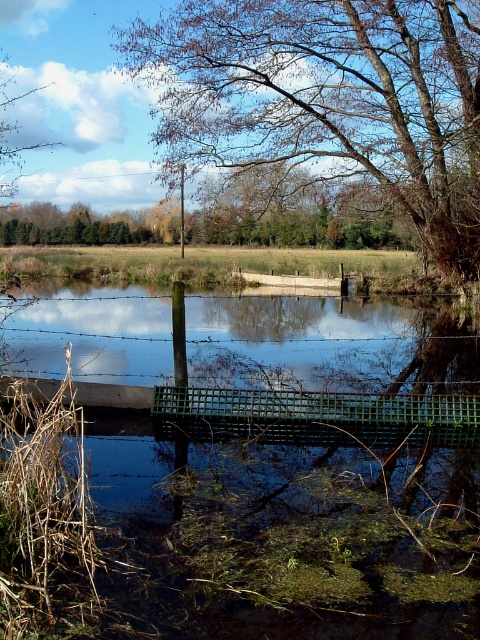
You are a hiker who wants to cross the green plastic bridge at center to reach the brown leafy tree at upper center. Which direction should you walk from the bridge to reach the tree?

The green plastic bridge at center is positioned on the left side of the brown leafy tree at upper center, so you should walk to the right from the bridge to reach the tree.

You are standing at the edge of the pond and see two points marked in the image. Which point, point [455,472] or point [377,173], is closer to you?

Point [455,472] is closer to you than point [377,173].